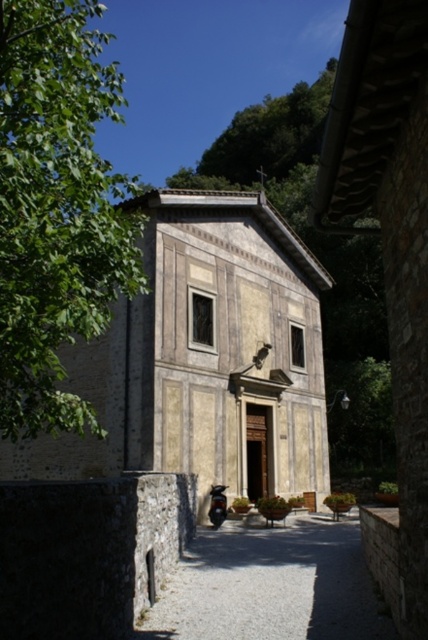
Looking at this image, A person wants to throw a small ball from the yellowish stone chapel at center to the green leafy tree at upper left. The ball can travel up to 10 meters. Do you think they can reach the tree?

The distance between the yellowish stone chapel at center and the green leafy tree at upper left is 10.10 meters, which is slightly beyond the ball travel distance of 10 meters. Therefore, the ball will not reach the tree.

You are a visitor standing at the entrance of the yellowish stone chapel at center. Looking towards the green leafy tree at upper left, which object appears taller from your perspective?

The green leafy tree at upper left appears taller than the yellowish stone chapel at center because the yellowish stone chapel at center has a lesser height compared to green leafy tree at upper left.